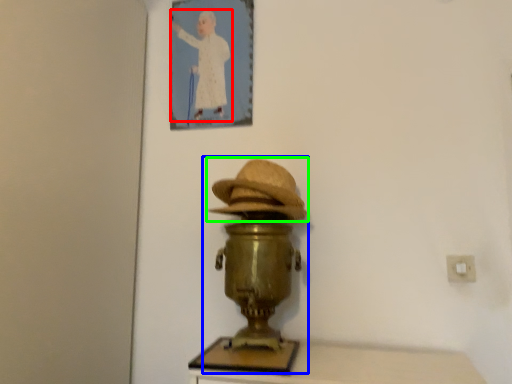
Question: Which object is positioned closest to person (highlighted by a red box)? Select from table lamp (highlighted by a blue box) and hat (highlighted by a green box).

Choices:
 (A) table lamp
 (B) hat

Answer: (B)